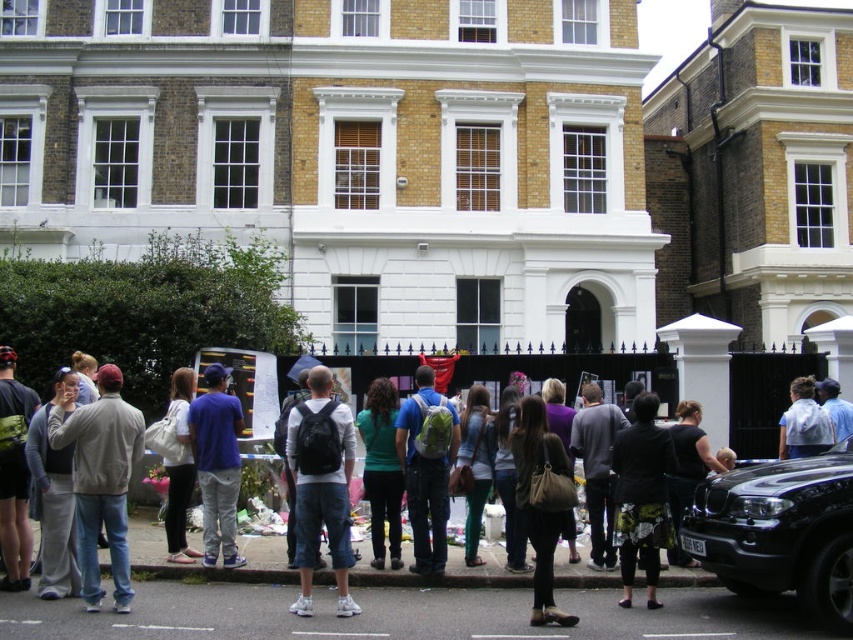
Question: Is light blue shirt at center positioned before metallic silver car at center?

Choices:
 (A) no
 (B) yes

Answer: (A)

Question: Which object is closer to the camera taking this photo?

Choices:
 (A) light blue shirt at center
 (B) floral-patterned skirt at center
 (C) metallic silver car at center

Answer: (C)

Question: Does black backpack at center have a greater width compared to white glossy line at lower center?

Choices:
 (A) yes
 (B) no

Answer: (B)

Question: Can you confirm if black fabric dress at center is positioned to the left of metallic silver car at center?

Choices:
 (A) yes
 (B) no

Answer: (B)

Question: Which of the following is the farthest from the observer?

Choices:
 (A) (213, 628)
 (B) (379, 428)
 (C) (709, 634)
 (D) (820, 406)

Answer: (D)

Question: Estimate the real-world distances between objects in this image. Which object is farther from the blue denim jeans at center?

Choices:
 (A) blue fabric cap at center
 (B) green backpack at center
 (C) gray fleece jacket at center

Answer: (C)